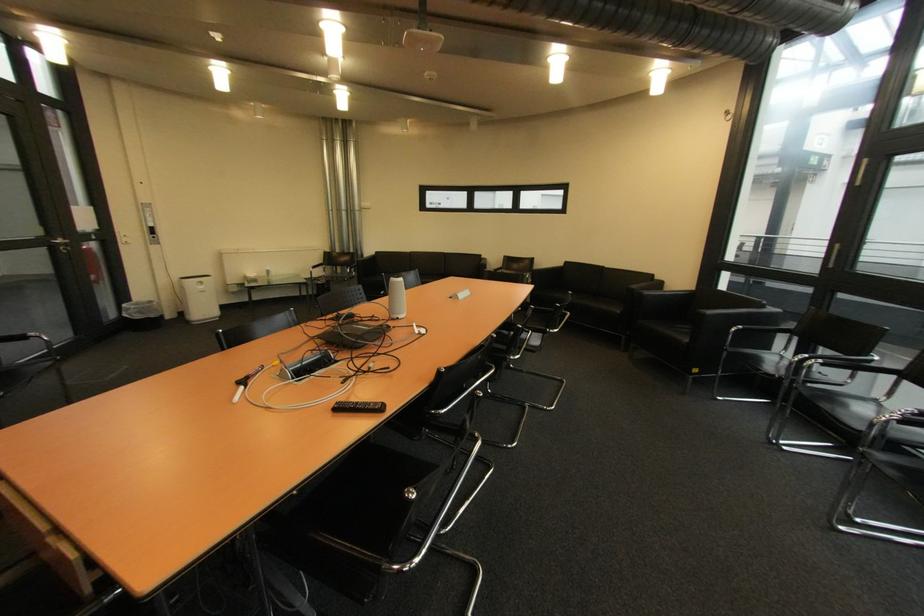
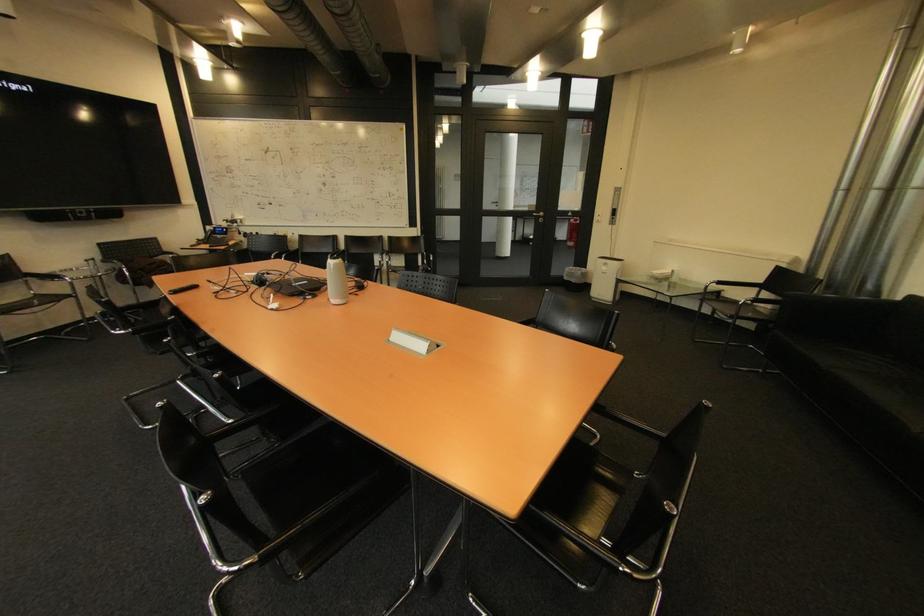
Find the pixel in the second image that matches [209,288] in the first image.

(613, 270)